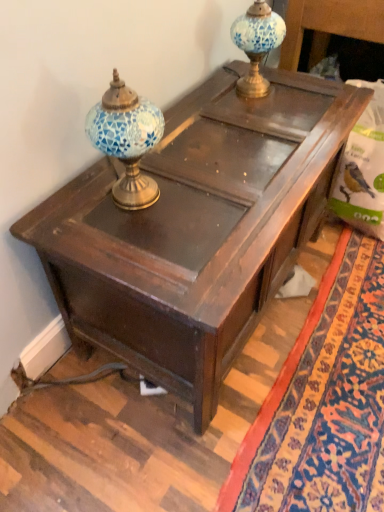
Question: Which direction should I rotate to look at blue mosaic glass lamp at upper center, acting as the 1th candle holder starting from the back, — up or down?

Choices:
 (A) up
 (B) down

Answer: (A)

Question: Is blue mosaic glass lamp at upper left, the first candle holder viewed from the left, positioned in front of wooden table at center?

Choices:
 (A) no
 (B) yes

Answer: (B)

Question: Would you say blue mosaic glass lamp at upper left, which ranks as the second candle holder in top-to-bottom order, contains wooden table at center?

Choices:
 (A) no
 (B) yes

Answer: (A)

Question: Would you say blue mosaic glass lamp at upper left, the 2th candle holder from the back, is outside wooden table at center?

Choices:
 (A) yes
 (B) no

Answer: (A)

Question: Is blue mosaic glass lamp at upper left, placed as the first candle holder when sorted from bottom to top, to the left of wooden table at center from the viewer's perspective?

Choices:
 (A) yes
 (B) no

Answer: (A)

Question: Is blue mosaic glass lamp at upper left, which is counted as the 2th candle holder, starting from the right, positioned with its back to wooden table at center?

Choices:
 (A) no
 (B) yes

Answer: (A)

Question: Does blue mosaic glass lamp at upper left, placed as the first candle holder when sorted from bottom to top, lie behind wooden table at center?

Choices:
 (A) no
 (B) yes

Answer: (A)

Question: Can you confirm if blue mosaic glass lamp at upper left, which is counted as the 2th candle holder, starting from the right, is shorter than blue mosaic glass lamp at upper center, acting as the 2th candle holder starting from the bottom?

Choices:
 (A) no
 (B) yes

Answer: (A)

Question: Is blue mosaic glass lamp at upper left, placed as the first candle holder when sorted from bottom to top, next to blue mosaic glass lamp at upper center, the 2th candle holder viewed from the front, and touching it?

Choices:
 (A) no
 (B) yes

Answer: (A)

Question: Considering the relative sizes of blue mosaic glass lamp at upper left, the first candle holder viewed from the left, and blue mosaic glass lamp at upper center, the first candle holder positioned from the top, in the image provided, is blue mosaic glass lamp at upper left, the first candle holder viewed from the left, taller than blue mosaic glass lamp at upper center, the first candle holder positioned from the top,?

Choices:
 (A) yes
 (B) no

Answer: (A)

Question: From the image's perspective, would you say blue mosaic glass lamp at upper left, placed as the first candle holder when sorted from bottom to top, is shown under blue mosaic glass lamp at upper center, the first candle holder positioned from the top?

Choices:
 (A) no
 (B) yes

Answer: (B)

Question: From a real-world perspective, is blue mosaic glass lamp at upper left, the first candle holder in the front-to-back sequence, over blue mosaic glass lamp at upper center, placed as the second candle holder when sorted from left to right?

Choices:
 (A) yes
 (B) no

Answer: (A)

Question: Does blue mosaic glass lamp at upper left, the first candle holder viewed from the left, appear on the left side of blue mosaic glass lamp at upper center, the first candle holder when ordered from right to left?

Choices:
 (A) no
 (B) yes

Answer: (B)

Question: Is blue mosaic glass lamp at upper center, the 2th candle holder viewed from the front, not near wooden table at center?

Choices:
 (A) yes
 (B) no

Answer: (B)